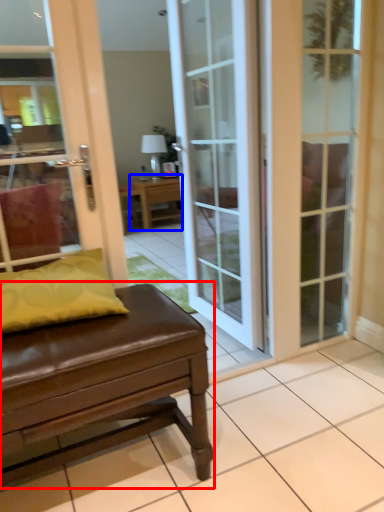
Question: Which of the following is the closest to the observer, table (highlighted by a red box) or table (highlighted by a blue box)?

Choices:
 (A) table
 (B) table

Answer: (A)